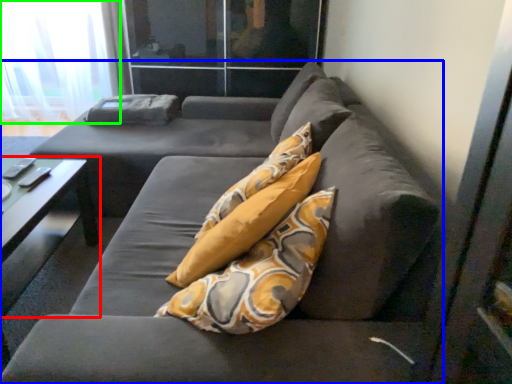
Question: Estimate the real-world distances between objects in this image. Which object is closer to table (highlighted by a red box), studio couch (highlighted by a blue box) or curtain (highlighted by a green box)?

Choices:
 (A) studio couch
 (B) curtain

Answer: (A)